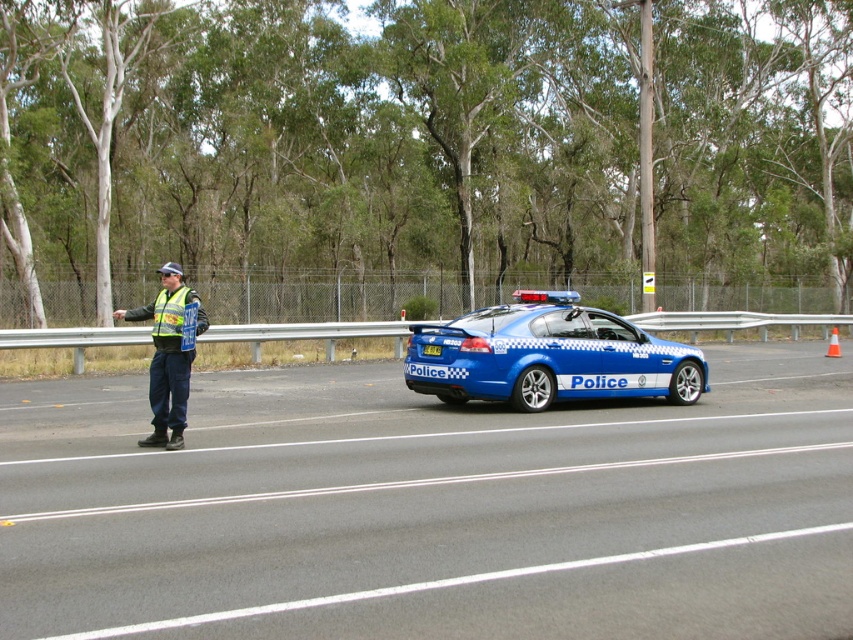
Can you confirm if blue metallic police car at center is shorter than blue glossy license plate at center?

No.

Describe the element at coordinates (549, 355) in the screenshot. The image size is (853, 640). I see `blue metallic police car at center` at that location.

Measure the distance between point [459,369] and camera.

The distance of point [459,369] from camera is 12.14 meters.

Identify the location of blue metallic police car at center. The height and width of the screenshot is (640, 853). (549, 355).

Find the location of a particular element. Image resolution: width=853 pixels, height=640 pixels. metallic gray barrier at center is located at coordinates (306, 333).

The image size is (853, 640). I want to click on metallic gray barrier at center, so click(306, 333).

Between point (343, 582) and point (438, 348), which one is positioned in front?

Positioned in front is point (343, 582).

Is asphalt road at center above blue glossy license plate at center?

Actually, asphalt road at center is below blue glossy license plate at center.

You are a GUI agent. You are given a task and a screenshot of the screen. Output one action in this format:
    pyautogui.click(x=<x>, y=<y>)
    Task: Click on the asphalt road at center
    This screenshot has height=640, width=853.
    Given the screenshot: What is the action you would take?
    pyautogui.click(x=432, y=509)

Find the location of a particular element. asphalt road at center is located at coordinates (432, 509).